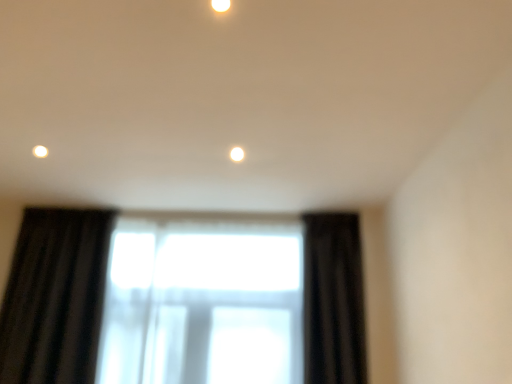
Image resolution: width=512 pixels, height=384 pixels. In order to click on black velvet curtain at right in this screenshot , I will do `click(333, 300)`.

What do you see at coordinates (54, 297) in the screenshot? I see `transparent fabric at center` at bounding box center [54, 297].

Measure the distance between matte white light fixture at upper center and camera.

1.18 meters.

Where is `black velvet curtain at right`? This screenshot has width=512, height=384. black velvet curtain at right is located at coordinates (333, 300).

From the image's perspective, is transparent fabric at center located above or below matte white light fixture at upper center?

transparent fabric at center is below matte white light fixture at upper center.

Which of these two, transparent fabric at center or matte white light fixture at upper center, is bigger?

With larger size is transparent fabric at center.

Between point (11, 285) and point (228, 5), which one is positioned behind?

The point (11, 285) is behind.

Considering the sizes of objects transparent fabric at center and matte white light fixture at upper center in the image provided, who is thinner, transparent fabric at center or matte white light fixture at upper center?

Thinner between the two is matte white light fixture at upper center.

Does black velvet curtain at right appear on the right side of transparent fabric at center?

Yes, black velvet curtain at right is to the right of transparent fabric at center.

Which is nearer, [347,365] or [95,349]?

Clearly, point [347,365] is closer to the camera than point [95,349].

Locate an element on the screen. This screenshot has height=384, width=512. curtain above the transparent fabric at center (from a real-world perspective) is located at coordinates (333, 300).

Looking at this image, is black velvet curtain at right closer to camera compared to transparent fabric at center?

Yes.

Is black velvet curtain at right looking in the opposite direction of matte white light fixture at upper center?

No, black velvet curtain at right is not facing the opposite direction of matte white light fixture at upper center.

How distant is black velvet curtain at right from matte white light fixture at upper center?

black velvet curtain at right is 6.64 feet away from matte white light fixture at upper center.

Can you confirm if black velvet curtain at right is bigger than matte white light fixture at upper center?

Yes.

Between point (305, 239) and point (219, 0), which one is positioned behind?

Positioned behind is point (305, 239).

In terms of size, does matte white light fixture at upper center appear bigger or smaller than black velvet curtain at right?

Considering their sizes, matte white light fixture at upper center takes up less space than black velvet curtain at right.

Considering the relative positions of matte white light fixture at upper center and black velvet curtain at right in the image provided, is matte white light fixture at upper center to the left of black velvet curtain at right from the viewer's perspective?

Correct, you'll find matte white light fixture at upper center to the left of black velvet curtain at right.

Does matte white light fixture at upper center have a greater width compared to black velvet curtain at right?

Incorrect, the width of matte white light fixture at upper center does not surpass that of black velvet curtain at right.

Which is correct: matte white light fixture at upper center is inside black velvet curtain at right, or outside of it?

matte white light fixture at upper center is spatially situated outside black velvet curtain at right.

Which is in front, matte white light fixture at upper center or transparent fabric at center?

matte white light fixture at upper center.

From the image's perspective, which one is positioned higher, matte white light fixture at upper center or transparent fabric at center?

matte white light fixture at upper center.

Is point (211, 2) closer to camera compared to point (324, 246)?

Yes, point (211, 2) is in front of point (324, 246).

How different are the orientations of matte white light fixture at upper center and transparent fabric at center in degrees?

89.5 degrees.

From the image's perspective, is transparent fabric at center located beneath black velvet curtain at right?

Yes.

Do you think transparent fabric at center is within black velvet curtain at right, or outside of it?

transparent fabric at center cannot be found inside black velvet curtain at right.

Is transparent fabric at center positioned far away from black velvet curtain at right?

Indeed, transparent fabric at center is not near black velvet curtain at right.

Is transparent fabric at center looking in the opposite direction of black velvet curtain at right?

No, black velvet curtain at right is not at the back of transparent fabric at center.

Find the location of a particular element. window lying on the left of matte white light fixture at upper center is located at coordinates (54, 297).

Locate an element on the screen. window that appears below the black velvet curtain at right (from the image's perspective) is located at coordinates (54, 297).

Based on their spatial positions, is matte white light fixture at upper center or black velvet curtain at right closer to transparent fabric at center?

Among the two, black velvet curtain at right is located nearer to transparent fabric at center.

Looking at this image, considering their positions, is matte white light fixture at upper center positioned further to black velvet curtain at right than transparent fabric at center?

matte white light fixture at upper center.

Estimate the real-world distances between objects in this image. Which object is further from matte white light fixture at upper center, black velvet curtain at right or transparent fabric at center?

Among the two, transparent fabric at center is located further to matte white light fixture at upper center.

From the image, which object appears to be farther from black velvet curtain at right, transparent fabric at center or matte white light fixture at upper center?

Among the two, matte white light fixture at upper center is located further to black velvet curtain at right.

Based on their spatial positions, is transparent fabric at center or black velvet curtain at right closer to matte white light fixture at upper center?

Based on the image, black velvet curtain at right appears to be nearer to matte white light fixture at upper center.

Estimate the real-world distances between objects in this image. Which object is further from transparent fabric at center, black velvet curtain at right or matte white light fixture at upper center?

Among the two, matte white light fixture at upper center is located further to transparent fabric at center.

Locate an element on the screen. curtain positioned between matte white light fixture at upper center and transparent fabric at center from near to far is located at coordinates (333, 300).